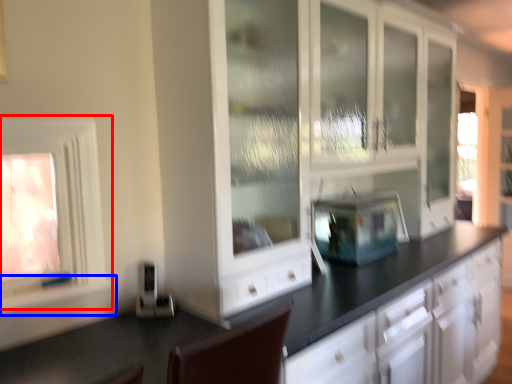
Question: Among these objects, which one is nearest to the camera, window (highlighted by a red box) or window sill (highlighted by a blue box)?

Choices:
 (A) window
 (B) window sill

Answer: (A)